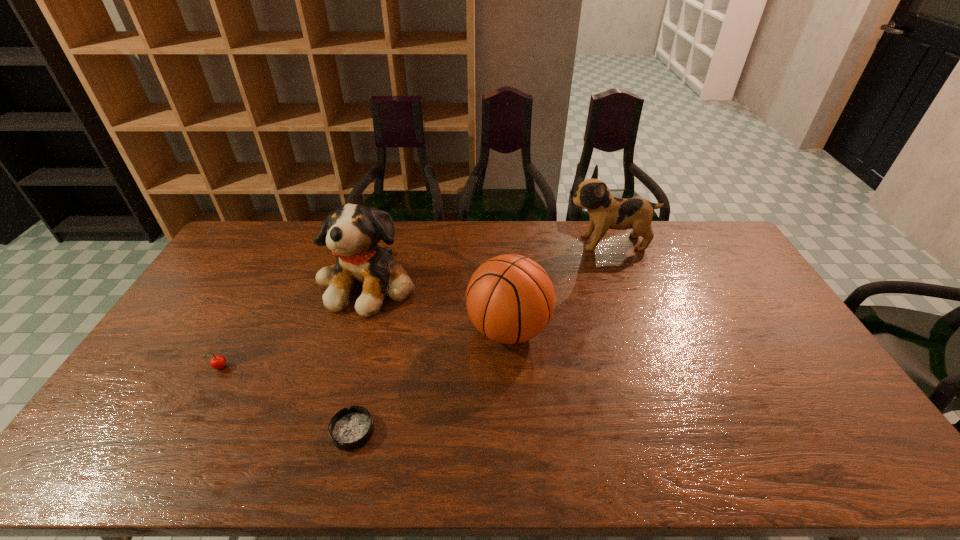
Locate which object ranks second in proximity to the right puppy. Please provide its 2D coordinates. Your answer should be formatted as a tuple, i.e. [(x, y)], where the tuple contains the x and y coordinates of a point satisfying the conditions above.

[(352, 232)]

Identify which object is the nearest to the fourth tallest object. Please provide its 2D coordinates. Your answer should be formatted as a tuple, i.e. [(x, y)], where the tuple contains the x and y coordinates of a point satisfying the conditions above.

[(352, 232)]

Find the location of a particular element. Image resolution: width=960 pixels, height=540 pixels. free space that satisfies the following two spatial constraints: 1. on the back side of the second object from right to left; 2. on the right side of the cherry is located at coordinates (242, 329).

Where is `vacant position in the image that satisfies the following two spatial constraints: 1. at the face of the right puppy; 2. on the front side of the leftmost object`? vacant position in the image that satisfies the following two spatial constraints: 1. at the face of the right puppy; 2. on the front side of the leftmost object is located at coordinates (656, 369).

This screenshot has width=960, height=540. What are the coordinates of `free space that satisfies the following two spatial constraints: 1. at the face of the left puppy; 2. on the right side of the basketball` in the screenshot? It's located at (356, 329).

At what (x,y) coordinates should I click in order to perform the action: click on free space in the image that satisfies the following two spatial constraints: 1. at the face of the ashtray; 2. on the left side of the left puppy. Please return your answer as a coordinate pair (x, y). Image resolution: width=960 pixels, height=540 pixels. Looking at the image, I should click on (326, 431).

The height and width of the screenshot is (540, 960). Find the location of `vacant space that satisfies the following two spatial constraints: 1. at the face of the right puppy; 2. at the face of the left puppy`. vacant space that satisfies the following two spatial constraints: 1. at the face of the right puppy; 2. at the face of the left puppy is located at coordinates click(624, 283).